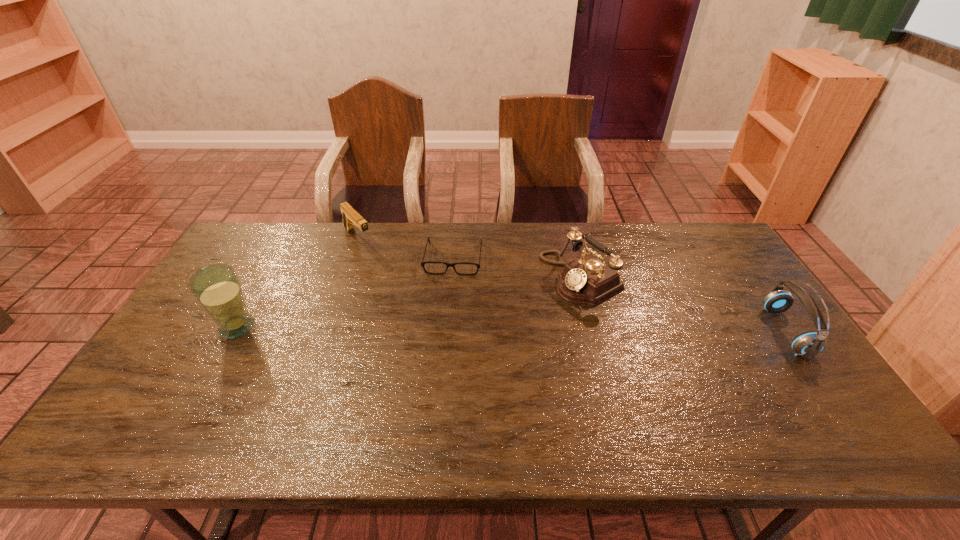
Locate an element on the screen. The width and height of the screenshot is (960, 540). free space that is in between the third object from left to right and the rightmost object is located at coordinates (619, 295).

This screenshot has width=960, height=540. Find the location of `vacant area between the pistol and the leftmost object`. vacant area between the pistol and the leftmost object is located at coordinates [x=298, y=283].

You are a GUI agent. You are given a task and a screenshot of the screen. Output one action in this format:
    pyautogui.click(x=<x>, y=<y>)
    Task: Click on the free spot between the headset and the spectacles
    
    Given the screenshot: What is the action you would take?
    coord(619,295)

Find the location of `vacant point located between the headset and the second object from right to left`. vacant point located between the headset and the second object from right to left is located at coordinates (684, 305).

Locate an element on the screen. The height and width of the screenshot is (540, 960). free space between the rightmost object and the second object from right to left is located at coordinates (684, 305).

Find the location of a particular element. free spot between the rightmost object and the third object from right to left is located at coordinates (619, 295).

You are a GUI agent. You are given a task and a screenshot of the screen. Output one action in this format:
    pyautogui.click(x=<x>, y=<y>)
    Task: Click on the free space between the telephone and the spectacles
    
    Given the screenshot: What is the action you would take?
    pyautogui.click(x=517, y=268)

What are the coordinates of `the fourth closest object to the rightmost object` in the screenshot? It's located at (217, 288).

Locate which object is the second closest to the telephone. Please provide its 2D coordinates. Your answer should be formatted as a tuple, i.e. [(x, y)], where the tuple contains the x and y coordinates of a point satisfying the conditions above.

[(807, 345)]